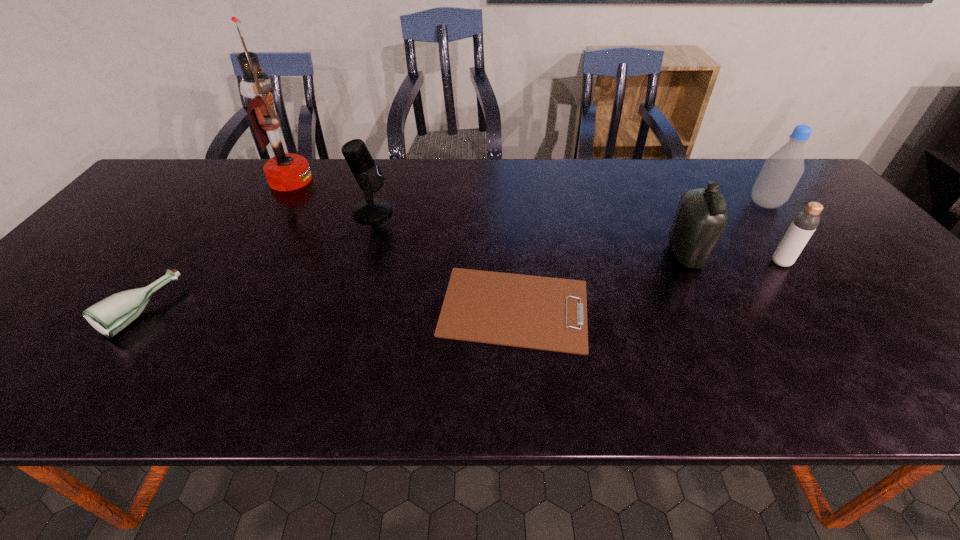
The height and width of the screenshot is (540, 960). Identify the location of vacant area between the microphone and the third bottle from right to left. (529, 233).

Locate an element on the screen. free space between the third bottle from left to right and the tallest object is located at coordinates (536, 221).

Find the location of a particular element. The width and height of the screenshot is (960, 540). free space between the second shortest bottle and the clipboard is located at coordinates (648, 285).

At what (x,y) coordinates should I click in order to perform the action: click on vacant space in between the second shortest object and the clipboard. Please return your answer as a coordinate pair (x, y). Image resolution: width=960 pixels, height=540 pixels. Looking at the image, I should click on (327, 309).

Identify the location of free space between the clipboard and the second object from right to left. (648, 285).

Identify the location of unoccupied position between the sixth object from left to right and the third object from right to left. The width and height of the screenshot is (960, 540). (732, 259).

In order to click on vacant area between the farthest bottle and the second object from left to right in this screenshot , I will do `click(528, 192)`.

Image resolution: width=960 pixels, height=540 pixels. What are the coordinates of `free space between the fourth object from left to right and the leftmost object` in the screenshot? It's located at (327, 309).

Identify the location of vacant area between the third bottle from right to left and the fourth object from left to right. This screenshot has width=960, height=540. (600, 281).

Select which object appears as the second closest to the fourth object from left to right. Please provide its 2D coordinates. Your answer should be formatted as a tuple, i.e. [(x, y)], where the tuple contains the x and y coordinates of a point satisfying the conditions above.

[(368, 175)]